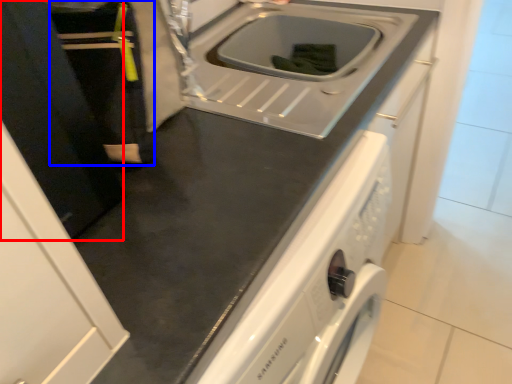
Question: Which object is further to the camera taking this photo, door (highlighted by a red box) or person (highlighted by a blue box)?

Choices:
 (A) door
 (B) person

Answer: (B)